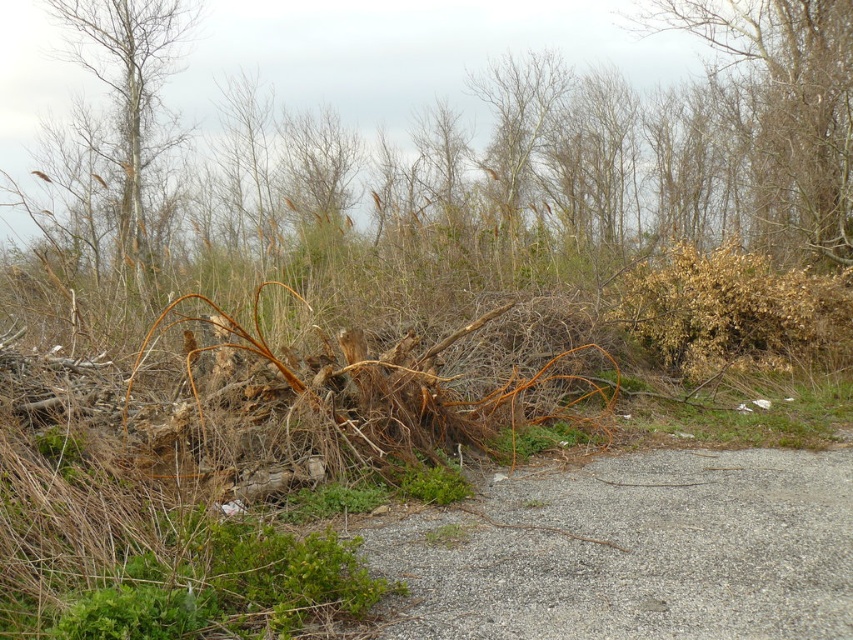
Question: Considering the real-world distances, which object is closest to the bare wood tree at upper left?

Choices:
 (A) gray gravel path at center
 (B) brown dry branches at upper right

Answer: (B)

Question: Can you confirm if brown dry branches at upper right is positioned below brown dry bush at right?

Choices:
 (A) no
 (B) yes

Answer: (A)

Question: Does brown dry branches at upper right appear on the right side of bare wood tree at upper left?

Choices:
 (A) no
 (B) yes

Answer: (B)

Question: Which object appears farthest from the camera in this image?

Choices:
 (A) brown dry bush at right
 (B) brown dry branches at upper right
 (C) bare wood tree at upper left

Answer: (B)

Question: Does brown dry branches at upper right appear over brown dry bush at right?

Choices:
 (A) no
 (B) yes

Answer: (B)

Question: Which point is farther from the camera taking this photo?

Choices:
 (A) (695, 291)
 (B) (148, 248)
 (C) (820, 209)
 (D) (486, 564)

Answer: (B)